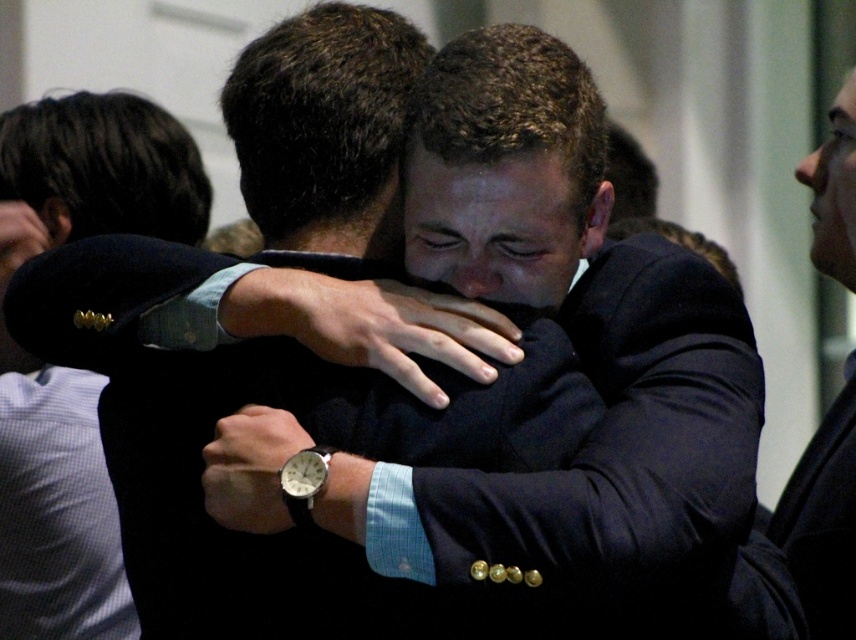
Between navy blue suit at center and dark blue suit at right, which one appears on the right side from the viewer's perspective?

dark blue suit at right

Which of these two, navy blue suit at center or dark blue suit at right, stands taller?

Standing taller between the two is navy blue suit at center.

Is point (181, 209) closer to camera compared to point (810, 564)?

No, (181, 209) is behind (810, 564).

The image size is (856, 640). What are the coordinates of `navy blue suit at center` in the screenshot? It's located at (57, 515).

Does dark blue suit at right have a greater width compared to black leather watch at center?

Indeed, dark blue suit at right has a greater width compared to black leather watch at center.

Can you confirm if dark blue suit at right is positioned below black leather watch at center?

Yes.

At what (x,y) coordinates should I click in order to perform the action: click on dark blue suit at right. Please return your answer as a coordinate pair (x, y). Image resolution: width=856 pixels, height=640 pixels. Looking at the image, I should click on (823, 520).

At what (x,y) coordinates should I click in order to perform the action: click on navy blue suit at center. Please return your answer as a coordinate pair (x, y). Looking at the image, I should click on (57, 515).

Can you confirm if navy blue suit at center is shorter than matte black suit sleeve at center?

Incorrect, navy blue suit at center's height does not fall short of matte black suit sleeve at center's.

Between point (52, 525) and point (16, 304), which one is positioned behind?

Point (52, 525)

In order to click on navy blue suit at center in this screenshot , I will do pos(57,515).